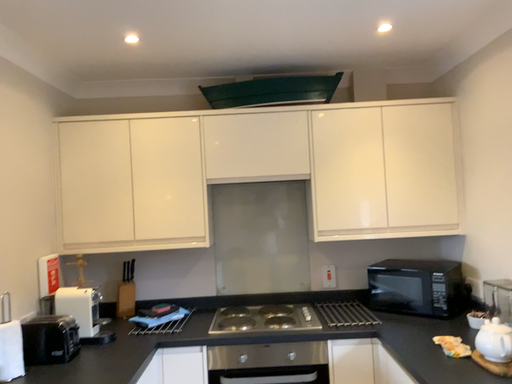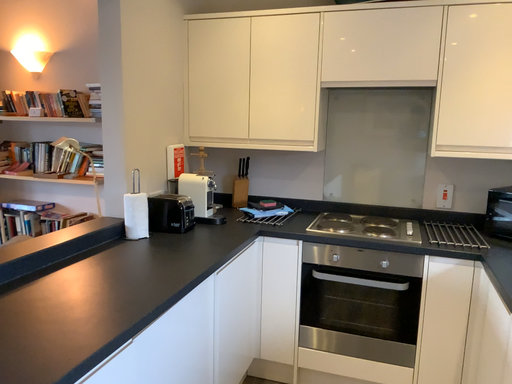
Question: Which way did the camera rotate in the video?

Choices:
 (A) rotated downward
 (B) rotated upward

Answer: (A)